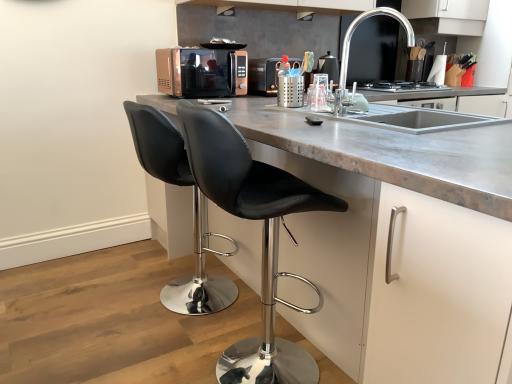
Question: Considering the positions of point (282, 215) and point (380, 13), is point (282, 215) closer or farther from the camera than point (380, 13)?

Choices:
 (A) farther
 (B) closer

Answer: (B)

Question: Considering the relative positions of black leather stool at center, the first chair viewed from the front, and polished chrome faucet at upper right in the image provided, is black leather stool at center, the first chair viewed from the front, to the left or to the right of polished chrome faucet at upper right?

Choices:
 (A) left
 (B) right

Answer: (A)

Question: Based on their relative distances, which object is farther from the metallic microwave at center?

Choices:
 (A) metallic silver faucet at upper center
 (B) black glass stove at center
 (C) black leather stool at lower left, the second chair viewed from the front
 (D) polished chrome faucet at upper right
 (E) matte black exhaust hood at upper center, which is the first exhaust hood from top to bottom

Answer: (C)

Question: Which object is positioned closest to the black matte exhaust hood at upper center, acting as the first exhaust hood starting from the left?

Choices:
 (A) black leather stool at lower left, positioned as the 1th chair in back-to-front order
 (B) black glass stove at center
 (C) white matte cabinet at center
 (D) matte black exhaust hood at upper center, which is the first exhaust hood from top to bottom
 (E) metallic microwave at center

Answer: (E)